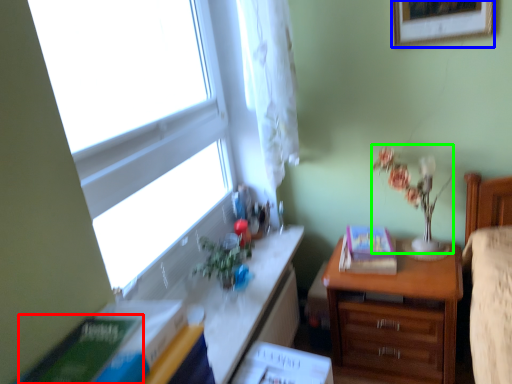
Question: Considering the real-world distances, which object is closest to paperback book (highlighted by a red box)? picture frame (highlighted by a blue box) or floral arrangement (highlighted by a green box).

Choices:
 (A) picture frame
 (B) floral arrangement

Answer: (B)